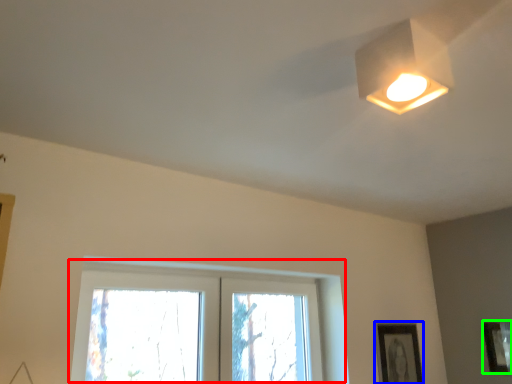
Question: Based on their relative distances, which object is nearer to window (highlighted by a red box)? Choose from picture frame (highlighted by a blue box) and picture frame (highlighted by a green box).

Choices:
 (A) picture frame
 (B) picture frame

Answer: (A)